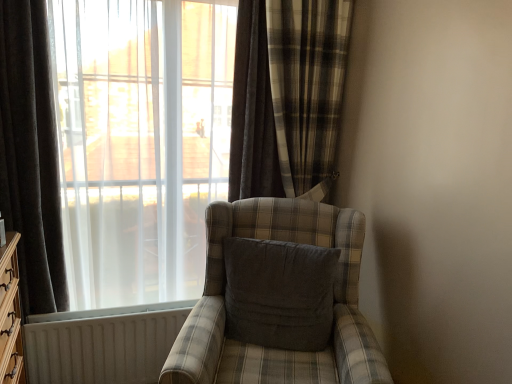
Question: From the image's perspective, is plaid fabric chair at center located above or below dark grey velvet curtain at left, the first curtain viewed from the left?

Choices:
 (A) above
 (B) below

Answer: (B)

Question: Is plaid fabric chair at center in front of or behind dark grey velvet curtain at left, placed as the second curtain when sorted from right to left, in the image?

Choices:
 (A) front
 (B) behind

Answer: (A)

Question: Estimate the real-world distances between objects in this image. Which object is closer to the white textured radiator at lower left?

Choices:
 (A) plaid fabric chair at center
 (B) dark gray fabric pillow at center
 (C) plaid fabric curtain at center, marked as the 1th curtain in a right-to-left arrangement
 (D) transparent fabric at left
 (E) dark grey velvet curtain at left, placed as the second curtain when sorted from right to left

Answer: (E)

Question: Considering the real-world distances, which object is farthest from the plaid fabric curtain at center, the second curtain from the left?

Choices:
 (A) transparent fabric at left
 (B) white textured radiator at lower left
 (C) plaid fabric chair at center
 (D) dark grey velvet curtain at left, the first curtain viewed from the left
 (E) dark gray fabric pillow at center

Answer: (B)